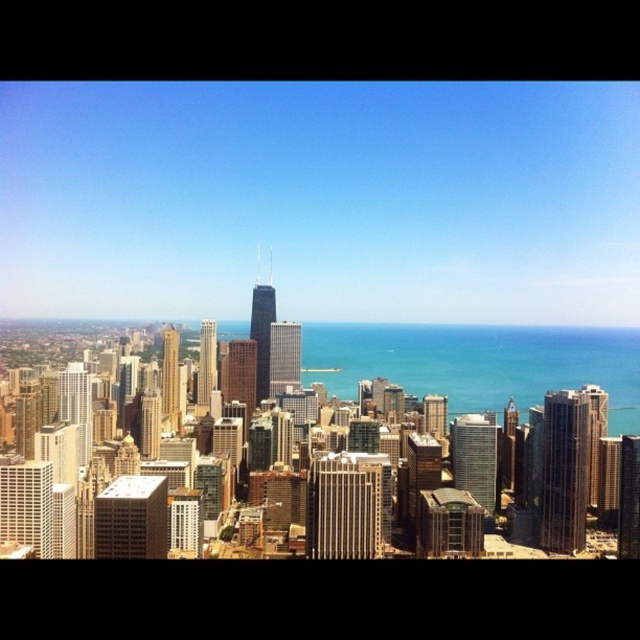
Question: Which is farther from the matte glass skyscraper at left?

Choices:
 (A) matte gray skyscraper at lower left
 (B) gold glass skyscraper at center-left
 (C) brown glass skyscraper at center-right

Answer: (C)

Question: Can you confirm if gold reflective skyscraper at lower left is smaller than glass skyscraper at center?

Choices:
 (A) yes
 (B) no

Answer: (B)

Question: Which point is farther to the camera?

Choices:
 (A) sleek silver skyscraper at center
 (B) gold reflective skyscraper at center

Answer: (B)

Question: Can you confirm if brown glass skyscraper at center-right is smaller than brown glass skyscraper at center?

Choices:
 (A) no
 (B) yes

Answer: (A)

Question: Which of the following is the farthest from the observer?

Choices:
 (A) (236, 362)
 (B) (252, 339)
 (C) (490, 493)
 (D) (118, 515)

Answer: (D)

Question: Can you confirm if matte gray skyscraper at lower left is positioned to the left of gold reflective skyscraper at center?

Choices:
 (A) yes
 (B) no

Answer: (A)